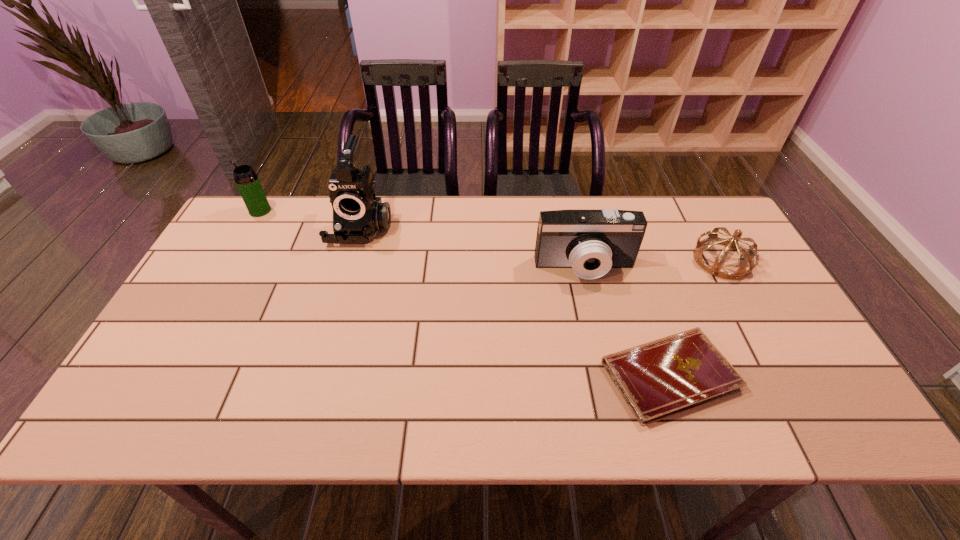
At what (x,y) coordinates should I click in order to perform the action: click on free space located 0.300m on the lens of the nearer camcorder. Please return your answer as a coordinate pair (x, y). Looking at the image, I should click on (611, 379).

I want to click on free location located 0.060m on the left of the rightmost object, so [673, 260].

I want to click on blank area located 0.260m on the back of the shortest object, so click(x=631, y=261).

You are a GUI agent. You are given a task and a screenshot of the screen. Output one action in this format:
    pyautogui.click(x=<x>, y=<y>)
    Task: Click on the camcorder that is positioned at the far edge
    Image resolution: width=960 pixels, height=540 pixels.
    Given the screenshot: What is the action you would take?
    pyautogui.click(x=358, y=216)

Locate an element on the screen. The height and width of the screenshot is (540, 960). thermos bottle located in the far edge section of the desktop is located at coordinates (247, 181).

You are a GUI agent. You are given a task and a screenshot of the screen. Output one action in this format:
    pyautogui.click(x=<x>, y=<y>)
    Task: Click on the tiara that is at the far edge
    
    Given the screenshot: What is the action you would take?
    (x=745, y=255)

The image size is (960, 540). Identify the location of object that is at the near edge. (659, 379).

Find the location of `object located at the left edge`. object located at the left edge is located at coordinates (247, 181).

Identify the location of object that is at the right edge. The image size is (960, 540). (745, 255).

Where is `object located in the far left corner section of the desktop`? The width and height of the screenshot is (960, 540). object located in the far left corner section of the desktop is located at coordinates (247, 181).